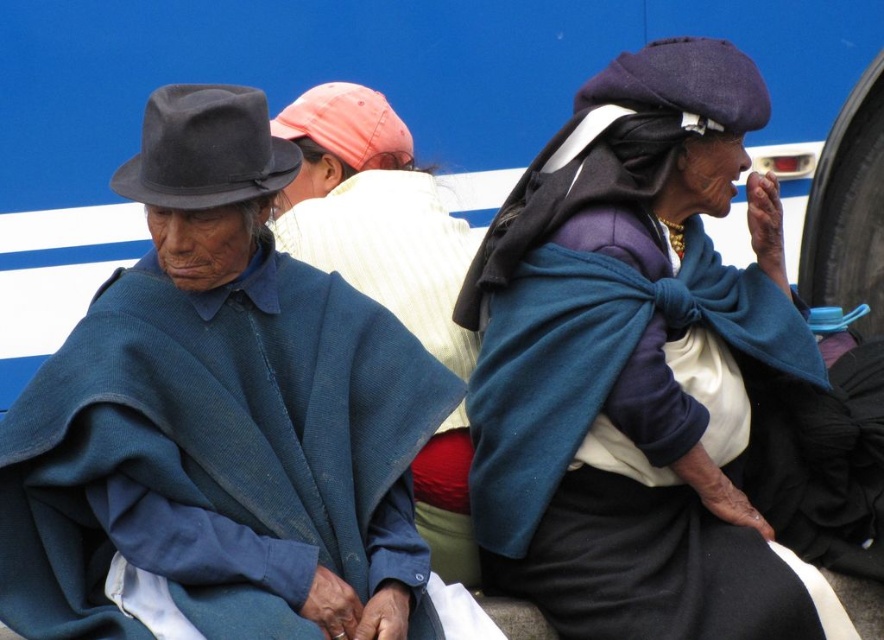
Between matte blue poncho at left and matte blue shawl at center, which one appears on the left side from the viewer's perspective?

matte blue poncho at left is more to the left.

Between matte blue poncho at left and matte blue shawl at center, which one is positioned lower?

matte blue poncho at left is lower down.

The height and width of the screenshot is (640, 884). What are the coordinates of `matte blue poncho at left` in the screenshot? It's located at (221, 419).

Identify the location of matte blue poncho at left. (x=221, y=419).

Measure the distance from matte blue shawl at center to blue woolen poncho at center.

11.01 feet

Does matte blue shawl at center have a smaller size compared to blue woolen poncho at center?

Yes.

Between point (625, 186) and point (463, 248), which one is positioned behind?

Point (463, 248)

At what (x,y) coordinates should I click in order to perform the action: click on matte blue shawl at center. Please return your answer as a coordinate pair (x, y). Looking at the image, I should click on (637, 365).

Does matte blue poncho at left appear on the left side of blue woolen poncho at center?

Correct, you'll find matte blue poncho at left to the left of blue woolen poncho at center.

Who is positioned more to the right, matte blue poncho at left or blue woolen poncho at center?

blue woolen poncho at center is more to the right.

The image size is (884, 640). I want to click on matte blue poncho at left, so click(221, 419).

Where is `matte blue poncho at left`? matte blue poncho at left is located at coordinates (221, 419).